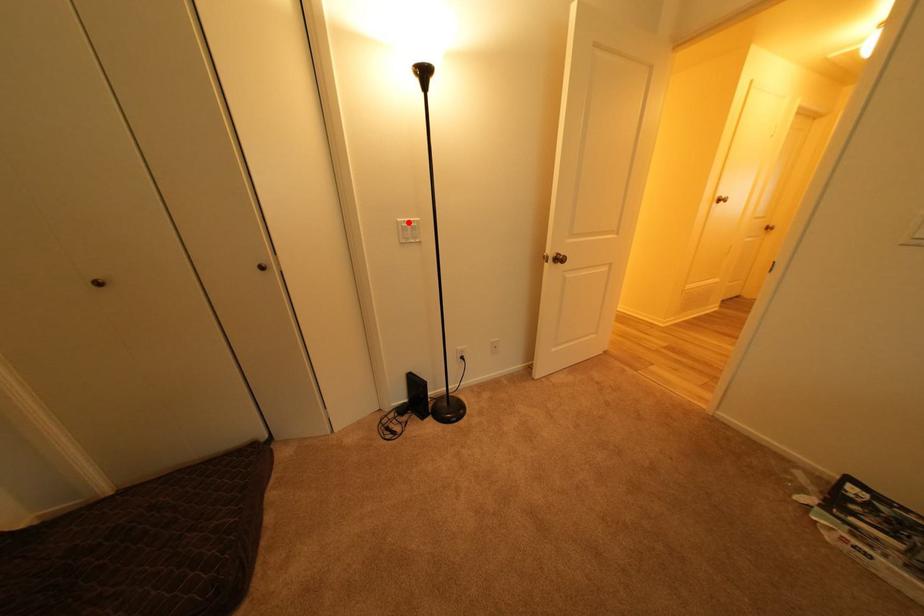
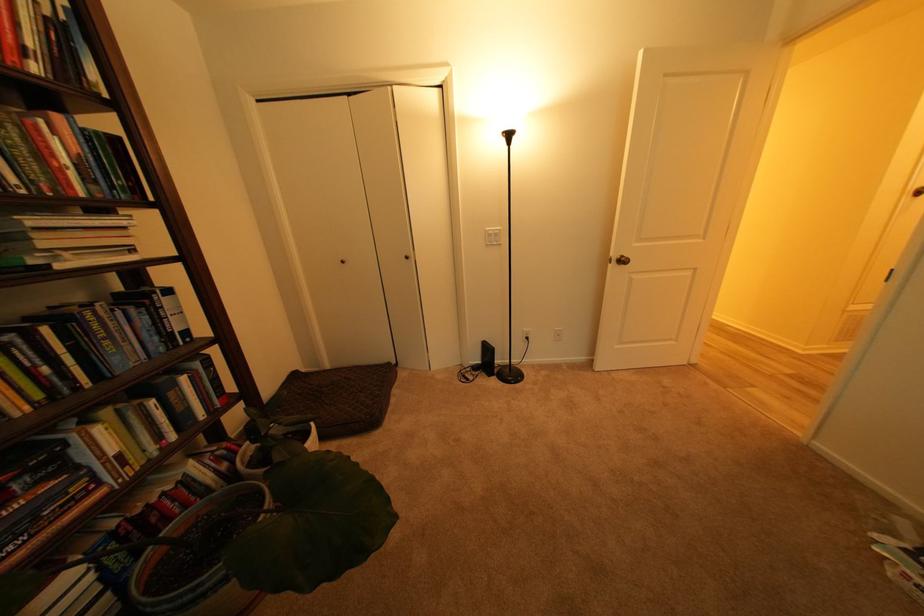
Locate, in the second image, the point that corresponds to the highlighted location in the first image.

(495, 232)